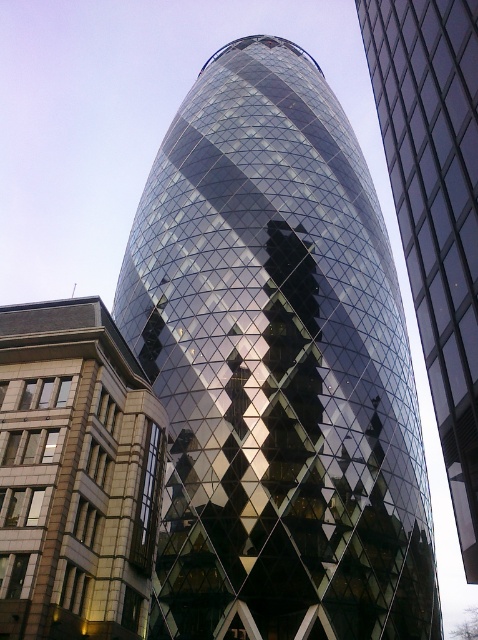
You are standing in the city square and see both the glossy glass tower at center and the reflective glass tower at center. Which one is positioned to the left when viewed from your perspective?

The glossy glass tower at center is positioned to the left of the reflective glass tower at center.

Based on the coordinates provided, where exactly is the glossy glass tower at center located in the image?

The glossy glass tower at center is located at point coordinates of (276, 369).

Looking at this image, you are standing in the courtyard of the Gherkin building and want to take a photo of the glossy glass tower at center. If your camera has a maximum focus range of 45 meters, will you be able to capture the tower clearly?

The glossy glass tower at center is 46.35 meters away from the viewer. Since the camera can only focus up to 45 meters, it won cannot capture the tower clearly.